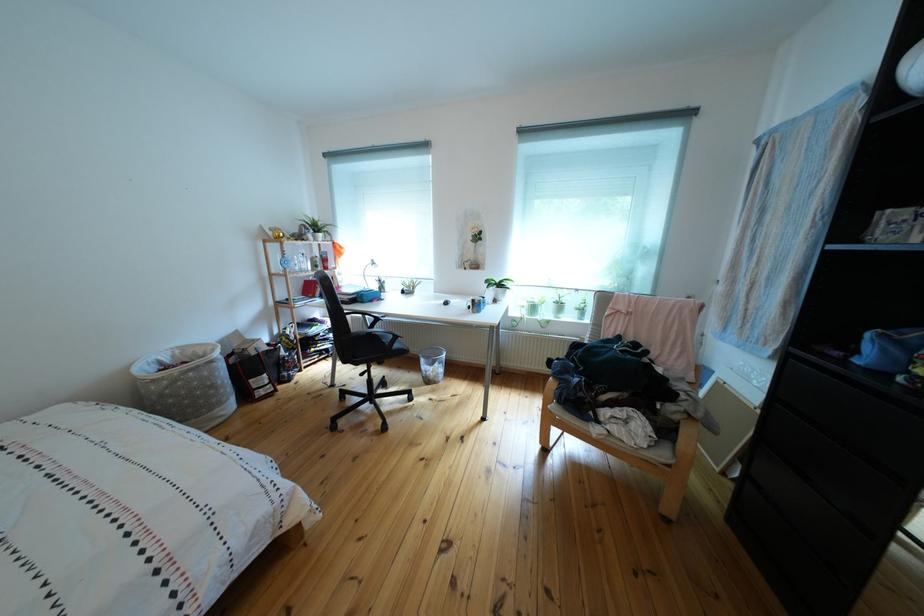
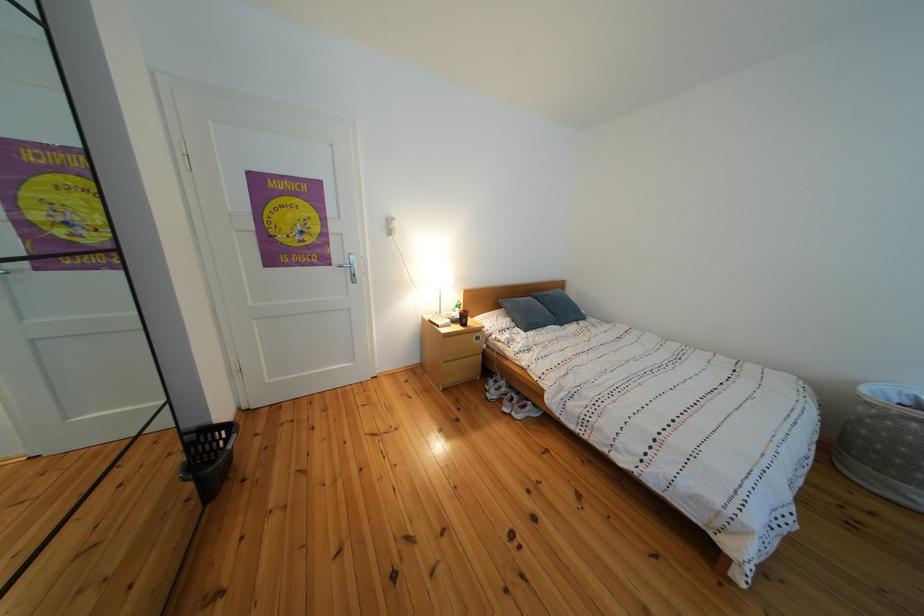
Locate, in the second image, the point that corresponds to the point at 153,376 in the first image.

(890, 398)